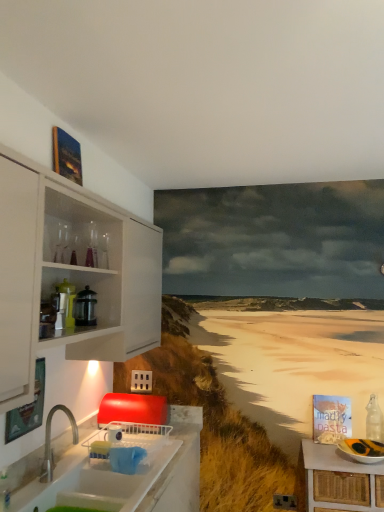
Where is `white wicker table at lower right`? white wicker table at lower right is located at coordinates (340, 480).

What is the approximate height of metallic glass coffee press at upper left?

metallic glass coffee press at upper left is 22.32 centimeters in height.

Identify the location of clear glass bottle at right. This screenshot has height=512, width=384. (374, 420).

What do you see at coordinates (125, 474) in the screenshot?
I see `white glossy countertop at lower left` at bounding box center [125, 474].

This screenshot has height=512, width=384. I want to click on white wicker table at lower right, so click(340, 480).

Between clear glass bottle at right and metallic glass coffee press at upper left, which one has smaller size?

With smaller size is metallic glass coffee press at upper left.

Looking at this image, considering the relative positions of clear glass bottle at right and metallic glass coffee press at upper left in the image provided, is clear glass bottle at right behind metallic glass coffee press at upper left?

Yes, the depth of clear glass bottle at right is greater than that of metallic glass coffee press at upper left.

Is clear glass bottle at right facing towards metallic glass coffee press at upper left?

No, clear glass bottle at right is not aimed at metallic glass coffee press at upper left.

Is point (372, 400) closer or farther from the camera than point (80, 296)?

Clearly, point (372, 400) is more distant from the camera than point (80, 296).

Can you tell me how much white wicker table at lower right and clear glass bottle at right differ in facing direction?

The angular difference between white wicker table at lower right and clear glass bottle at right is 0.955 degrees.

Can you confirm if white wicker table at lower right is shorter than clear glass bottle at right?

No, white wicker table at lower right is not shorter than clear glass bottle at right.

Measure the distance between white wicker table at lower right and clear glass bottle at right.

They are 17.69 inches apart.

Considering the relative sizes of white wicker table at lower right and clear glass bottle at right in the image provided, is white wicker table at lower right bigger than clear glass bottle at right?

Yes, white wicker table at lower right is bigger than clear glass bottle at right.

Considering the relative sizes of metallic glass coffee press at upper left and clear glass bottle at right in the image provided, is metallic glass coffee press at upper left smaller than clear glass bottle at right?

Yes.

Can you confirm if metallic glass coffee press at upper left is positioned to the right of clear glass bottle at right?

No, metallic glass coffee press at upper left is not to the right of clear glass bottle at right.

How much distance is there between metallic glass coffee press at upper left and clear glass bottle at right?

metallic glass coffee press at upper left and clear glass bottle at right are 5.66 feet apart from each other.

From the image's perspective, which one is positioned lower, metallic glass coffee press at upper left or clear glass bottle at right?

clear glass bottle at right is shown below in the image.

Between white glossy countertop at lower left and metallic glass coffee press at upper left, which one appears on the left side from the viewer's perspective?

metallic glass coffee press at upper left.

Who is bigger, white glossy countertop at lower left or metallic glass coffee press at upper left?

Bigger between the two is white glossy countertop at lower left.

Is white glossy countertop at lower left next to metallic glass coffee press at upper left and touching it?

No, white glossy countertop at lower left is not next to metallic glass coffee press at upper left.

Measure the distance from white glossy countertop at lower left to metallic glass coffee press at upper left.

white glossy countertop at lower left and metallic glass coffee press at upper left are 30.49 inches apart from each other.

Does point (355, 493) lie behind point (169, 501)?

Yes, point (355, 493) is farther from viewer.

From the image's perspective, which is below, white wicker table at lower right or white glossy countertop at lower left?

From the image's view, white wicker table at lower right is below.

Would you say white wicker table at lower right is a long distance from white glossy countertop at lower left?

white wicker table at lower right is actually quite close to white glossy countertop at lower left.

Is white glossy countertop at lower left a part of white wicker table at lower right?

No, white glossy countertop at lower left is not surrounded by white wicker table at lower right.

Who is bigger, clear glass bottle at right or white wicker table at lower right?

white wicker table at lower right.

Looking at this image, does clear glass bottle at right turn towards white wicker table at lower right?

No, clear glass bottle at right is not aimed at white wicker table at lower right.

Who is shorter, clear glass bottle at right or white wicker table at lower right?

Standing shorter between the two is clear glass bottle at right.

Is clear glass bottle at right to the right of white wicker table at lower right from the viewer's perspective?

Yes, clear glass bottle at right is to the right of white wicker table at lower right.

In the image, is white glossy countertop at lower left positioned in front of or behind clear glass bottle at right?

Visually, white glossy countertop at lower left is located in front of clear glass bottle at right.

Measure the distance between white glossy countertop at lower left and clear glass bottle at right.

They are 1.35 meters apart.

Is white glossy countertop at lower left at the right side of clear glass bottle at right?

Incorrect, white glossy countertop at lower left is not on the right side of clear glass bottle at right.

From the picture: Considering the sizes of objects white glossy countertop at lower left and clear glass bottle at right in the image provided, who is smaller, white glossy countertop at lower left or clear glass bottle at right?

clear glass bottle at right.

You are a GUI agent. You are given a task and a screenshot of the screen. Output one action in this format:
    pyautogui.click(x=<x>, y=<y>)
    Task: Click on the bottle lying below the metallic glass coffee press at upper left (from the image's perspective)
    Image resolution: width=384 pixels, height=512 pixels.
    Given the screenshot: What is the action you would take?
    pyautogui.click(x=374, y=420)

In order to click on table that is on the left side of clear glass bottle at right in this screenshot , I will do `click(340, 480)`.

From the image, which object appears to be nearer to clear glass bottle at right, white glossy countertop at lower left or white wicker table at lower right?

white wicker table at lower right is closer to clear glass bottle at right.

Considering their positions, is white wicker table at lower right positioned further to clear glass bottle at right than white glossy countertop at lower left?

Among the two, white glossy countertop at lower left is located further to clear glass bottle at right.

From the image, which object appears to be farther from metallic glass coffee press at upper left, clear glass bottle at right or white wicker table at lower right?

clear glass bottle at right is positioned further to the anchor metallic glass coffee press at upper left.

From the image, which object appears to be farther from white glossy countertop at lower left, white wicker table at lower right or clear glass bottle at right?

Among the two, clear glass bottle at right is located further to white glossy countertop at lower left.

Based on their spatial positions, is clear glass bottle at right or white wicker table at lower right closer to white glossy countertop at lower left?

white wicker table at lower right is closer to white glossy countertop at lower left.

When comparing their distances from white glossy countertop at lower left, does metallic glass coffee press at upper left or clear glass bottle at right seem further?

The object further to white glossy countertop at lower left is clear glass bottle at right.

Looking at the image, which one is located closer to metallic glass coffee press at upper left, white glossy countertop at lower left or white wicker table at lower right?

white glossy countertop at lower left lies closer to metallic glass coffee press at upper left than the other object.

Looking at the image, which one is located further to white wicker table at lower right, metallic glass coffee press at upper left or clear glass bottle at right?

Among the two, metallic glass coffee press at upper left is located further to white wicker table at lower right.

This screenshot has height=512, width=384. Identify the location of table between metallic glass coffee press at upper left and clear glass bottle at right in the horizontal direction. (340, 480).

The width and height of the screenshot is (384, 512). I want to click on countertop between metallic glass coffee press at upper left and white wicker table at lower right in the horizontal direction, so click(x=125, y=474).

At what (x,y) coordinates should I click in order to perform the action: click on countertop between metallic glass coffee press at upper left and clear glass bottle at right from left to right. Please return your answer as a coordinate pair (x, y). The image size is (384, 512). Looking at the image, I should click on (125, 474).

The height and width of the screenshot is (512, 384). I want to click on table between white glossy countertop at lower left and clear glass bottle at right, so click(340, 480).